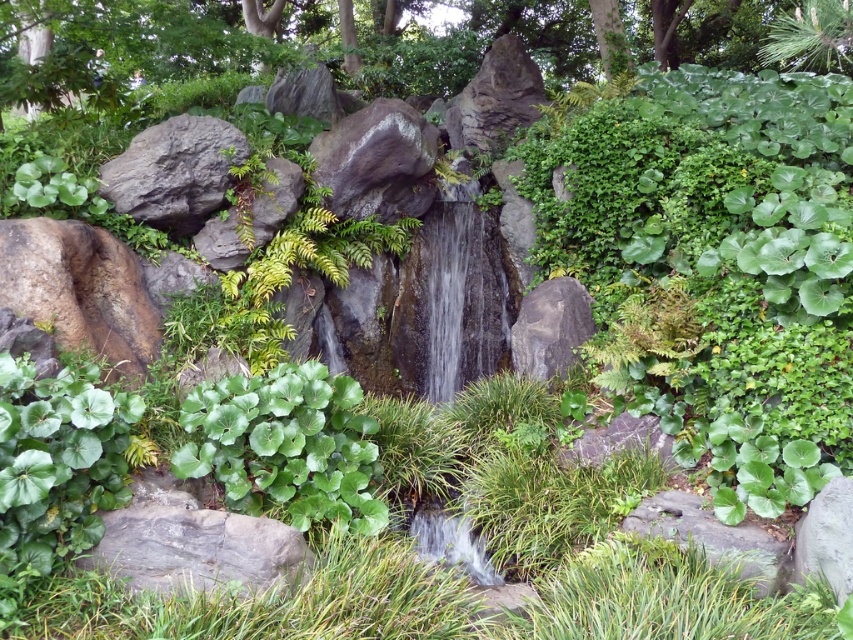
Question: Is gray rough boulder at upper left positioned at the back of gray rough rock at lower right?

Choices:
 (A) yes
 (B) no

Answer: (A)

Question: Which of the following is the closest to the observer?

Choices:
 (A) rough gray rock at upper center
 (B) green leafy tree at upper center
 (C) gray rough rock at lower right
 (D) brown rough rock at lower left

Answer: (C)

Question: Observing the image, what is the correct spatial positioning of brown rough rock at lower left in reference to gray rough boulder at upper left?

Choices:
 (A) left
 (B) right

Answer: (A)

Question: Estimate the real-world distances between objects in this image. Which object is farther from the gray rough rock at lower left?

Choices:
 (A) smooth gray rock at center
 (B) rough gray rock at upper center

Answer: (B)

Question: Does gray rough rock at lower left appear on the right side of gray rough rock at lower right?

Choices:
 (A) no
 (B) yes

Answer: (A)

Question: Which of the following is the farthest from the observer?

Choices:
 (A) (231, 54)
 (B) (569, 292)
 (C) (824, 532)

Answer: (A)